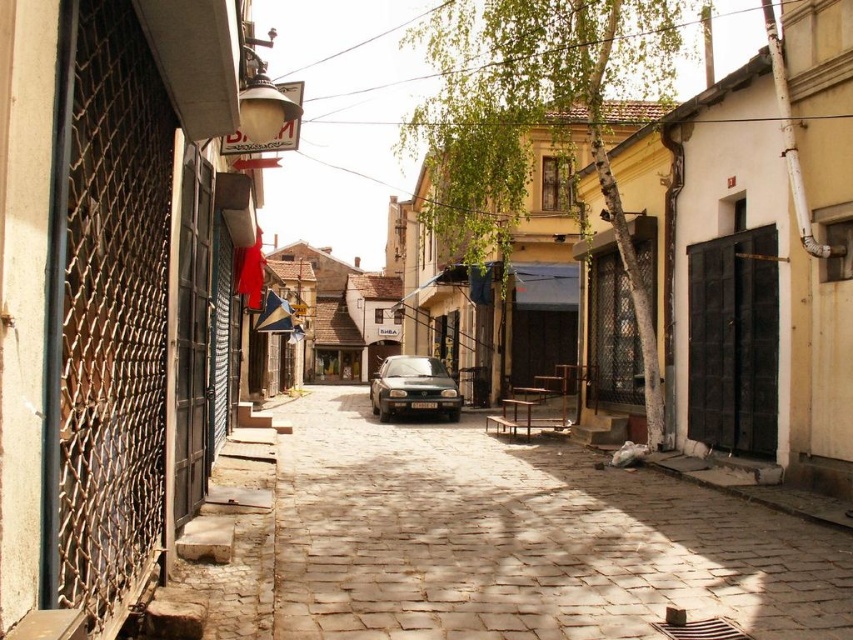
You are standing on the cobblestone street and want to walk towards the point that is closer to you. Which point should you head towards, point (598, 632) or point (444, 376)?

You should head towards point (598, 632) because it is closer to the viewer compared to point (444, 376).

You are driving a car that is 15 feet long. You see the brown cobblestone alley at center and the satin black car at center. Can your car fit into the space between them?

The brown cobblestone alley at center is 27.09 feet away from the satin black car at center. Since your car is 15 feet long, it can fit into the space between them as there is enough distance.

You are a delivery person trying to drive a 2.5 meters tall truck into the narrow cobblestone street. The truck needs to pass through the brown cobblestone alley at center and the satin black car at center. Based on their heights, which object will pose a problem for the truck to pass through?

The satin black car at center has a greater height than the brown cobblestone alley at center. Since the truck is 2.5 meters tall, it might hit the satin black car at center if its height exceeds the alleyway clearance.